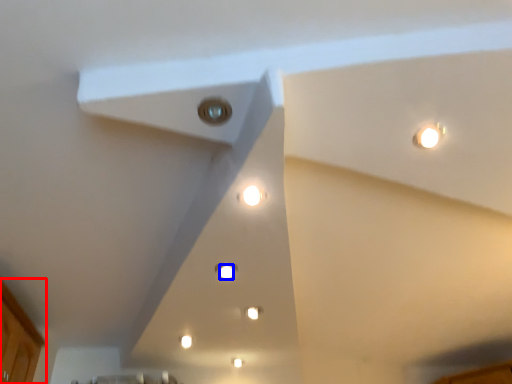
Question: Which of the following is the closest to the observer, cabinetry (highlighted by a red box) or light (highlighted by a blue box)?

Choices:
 (A) cabinetry
 (B) light

Answer: (A)